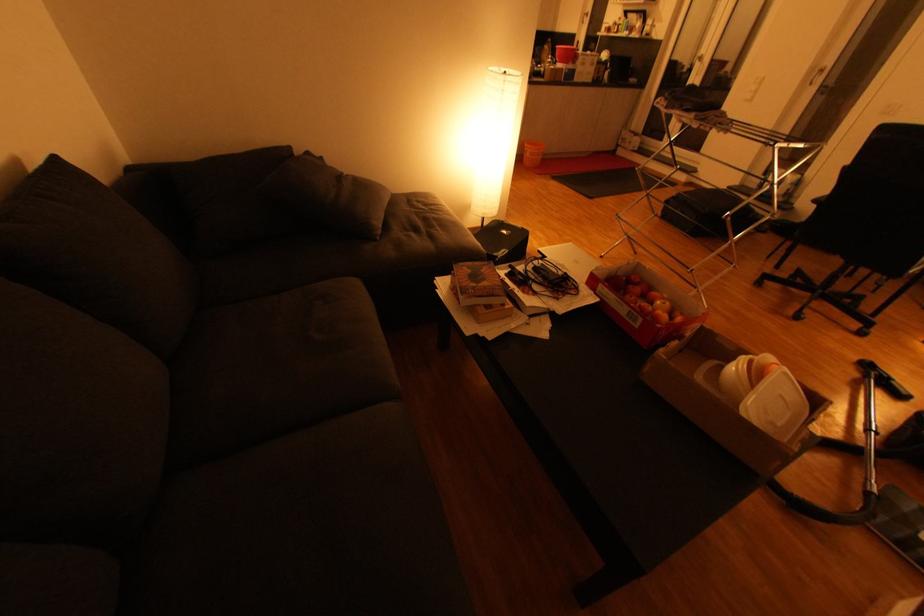
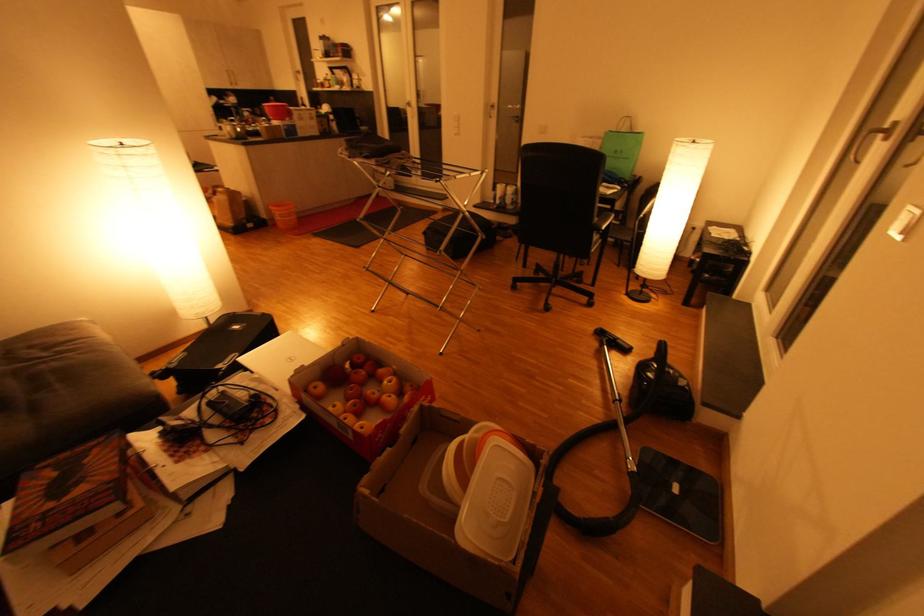
In the second image, find the point that corresponds to pixel 682 342 in the first image.

(394, 448)